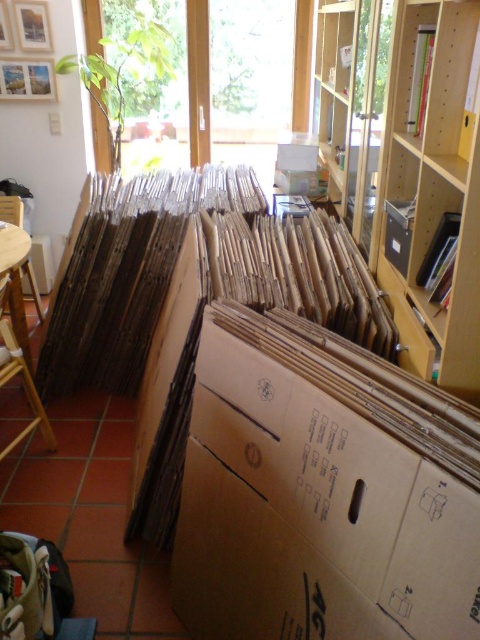
You are organizing items in the room and need to place a new item on the brown cardboard box at center. Given that the box is at coordinates 0.769, 0.673, can you confirm its exact position relative to the shelves on the right?

The brown cardboard box at center is located at point (x=323, y=492), which means it is positioned to the left of the shelves on the right since the coordinates indicate its placement in the central area of the image, away from the right side where the shelves are situated.

You are organizing items in the room and need to place a new tall plant that requires a spot where it won not block the window. Considering the brown cardboard box at center and the wooden bookshelf at center, which object is shorter and thus safer to place the plant next to to avoid blocking the window?

The brown cardboard box at center is not as tall as the wooden bookshelf at center, so placing the plant next to the brown cardboard box at center would be safer to avoid blocking the window.